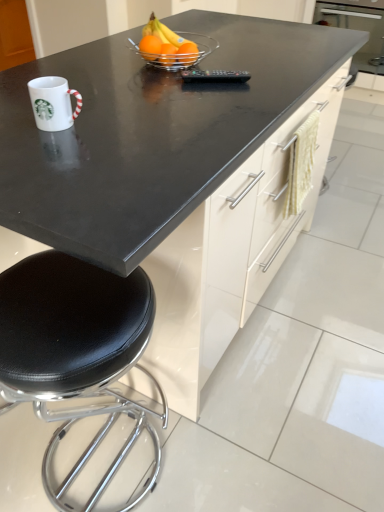
Locate an element on the screen. The height and width of the screenshot is (512, 384). free spot to the right of white glossy mug at left is located at coordinates (135, 124).